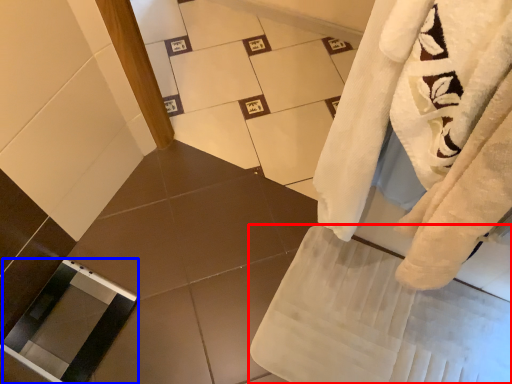
Question: Which of the following is the closest to the observer, bath towel (highlighted by a red box) or screen door (highlighted by a blue box)?

Choices:
 (A) bath towel
 (B) screen door

Answer: (A)